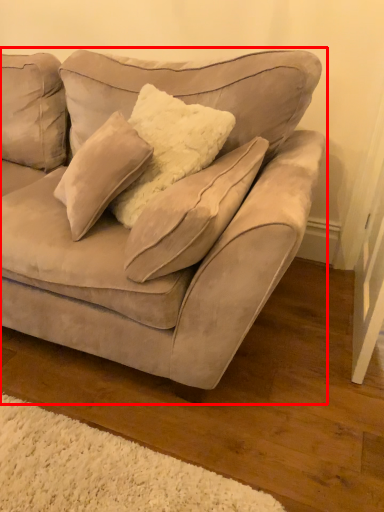
Question: From the image's perspective, what is the correct spatial positioning of studio couch (annotated by the red box) in reference to pillow?

Choices:
 (A) below
 (B) above

Answer: (B)